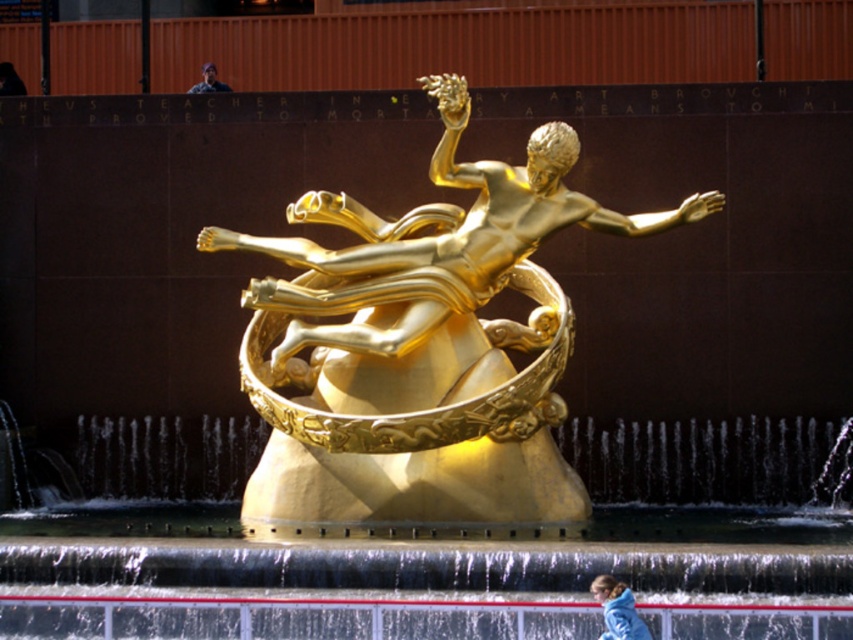
You are standing at the edge of the fountain and see the gold polished statue at center marked by point (422, 337). If you walk directly towards the statue, will you step into the water?

The gold polished statue at center is represented by point (422, 337), which is at the center of the fountain. Since the statue is in the fountain with water around its base, walking directly towards it from the edge would require stepping into the water.

You are standing in front of the fountain and want to see both the blue fleece jacket at lower right and the dark blue fabric person at upper center. Which one do you need to look down at more?

The blue fleece jacket at lower right is shorter than the dark blue fabric person at upper center, so you need to look down more to see the blue fleece jacket at lower right.

You are standing in a park and see the gold polished statue at center and the blue fleece jacket at lower right. Which object is located to the left of the other?

The gold polished statue at center is positioned on the left side of blue fleece jacket at lower right.